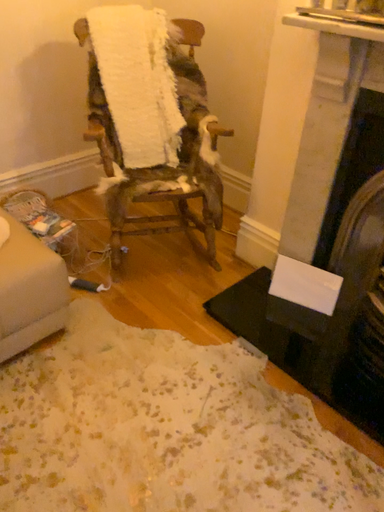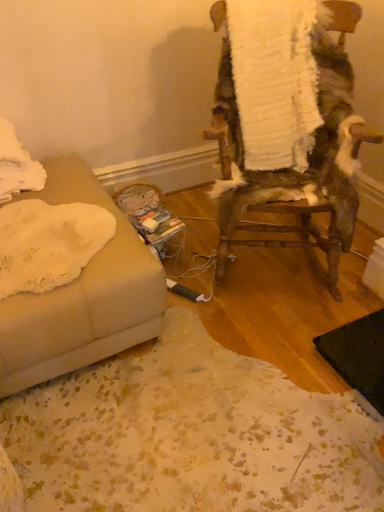
Question: Which way did the camera rotate in the video?

Choices:
 (A) rotated left
 (B) rotated right

Answer: (A)